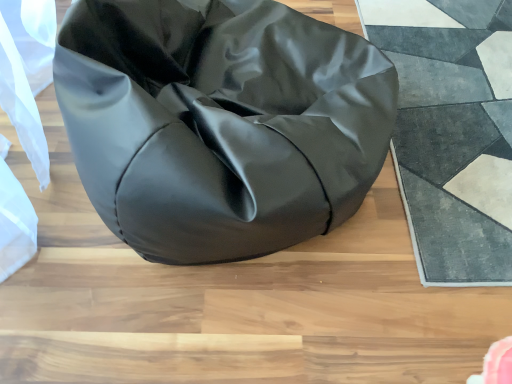
This screenshot has width=512, height=384. What do you see at coordinates (220, 123) in the screenshot? I see `matte black bean bag at center` at bounding box center [220, 123].

Locate an element on the screen. This screenshot has width=512, height=384. matte black bean bag at center is located at coordinates tap(220, 123).

Describe the element at coordinates (452, 132) in the screenshot. I see `textured gray rug at right` at that location.

Identify the location of textured gray rug at right. The height and width of the screenshot is (384, 512). (452, 132).

Where is `matte black bean bag at center`? matte black bean bag at center is located at coordinates (220, 123).

Is matte black bean bag at center to the right of textured gray rug at right from the viewer's perspective?

No.

Is matte black bean bag at center behind textured gray rug at right?

No, matte black bean bag at center is closer to the camera.

Is point (78, 35) farther from camera compared to point (499, 186)?

No, it is in front of (499, 186).

From the image's perspective, which is above, matte black bean bag at center or textured gray rug at right?

matte black bean bag at center appears higher in the image.

From a real-world perspective, is matte black bean bag at center under textured gray rug at right?

No, from a real-world perspective, matte black bean bag at center is not below textured gray rug at right.

Considering the sizes of objects matte black bean bag at center and textured gray rug at right in the image provided, who is wider, matte black bean bag at center or textured gray rug at right?

matte black bean bag at center.

Between matte black bean bag at center and textured gray rug at right, which one has more height?

With more height is matte black bean bag at center.

Can you confirm if matte black bean bag at center is bigger than textured gray rug at right?

Yes, matte black bean bag at center is bigger than textured gray rug at right.

Do you think matte black bean bag at center is within textured gray rug at right, or outside of it?

matte black bean bag at center is not enclosed by textured gray rug at right.

Is matte black bean bag at center touching textured gray rug at right?

No, matte black bean bag at center is not making contact with textured gray rug at right.

Could you tell me if matte black bean bag at center is turned towards textured gray rug at right?

No.

Where is `furniture above the textured gray rug at right (from a real-world perspective)`? furniture above the textured gray rug at right (from a real-world perspective) is located at coordinates (220, 123).

Can you confirm if textured gray rug at right is positioned to the left of matte black bean bag at center?

No, textured gray rug at right is not to the left of matte black bean bag at center.

From the picture: Is textured gray rug at right further to camera compared to matte black bean bag at center?

That is True.

Considering the points (489, 68) and (293, 97), which point is in front, point (489, 68) or point (293, 97)?

The point (293, 97) is closer to the camera.

In the scene shown: From the image's perspective, does textured gray rug at right appear higher than matte black bean bag at center?

No, from the image's perspective, textured gray rug at right is not on top of matte black bean bag at center.

From a real-world perspective, is textured gray rug at right on top of matte black bean bag at center?

No, from a real-world perspective, textured gray rug at right is not on top of matte black bean bag at center.

Consider the image. Which of these two, textured gray rug at right or matte black bean bag at center, is thinner?

textured gray rug at right is thinner.

Between textured gray rug at right and matte black bean bag at center, which one has less height?

With less height is textured gray rug at right.

Looking at the image, does textured gray rug at right seem bigger or smaller compared to matte black bean bag at center?

Clearly, textured gray rug at right is smaller in size than matte black bean bag at center.

Is textured gray rug at right situated inside matte black bean bag at center or outside?

textured gray rug at right cannot be found inside matte black bean bag at center.

Is textured gray rug at right next to matte black bean bag at center and touching it?

textured gray rug at right and matte black bean bag at center are clearly separated.

Is textured gray rug at right oriented away from matte black bean bag at center?

No, textured gray rug at right is not facing away from matte black bean bag at center.

How many degrees apart are the facing directions of textured gray rug at right and matte black bean bag at center?

The angular difference between textured gray rug at right and matte black bean bag at center is 90 degrees.

Locate an element on the screen. This screenshot has width=512, height=384. mat directly beneath the matte black bean bag at center (from a real-world perspective) is located at coordinates (452, 132).

Find the location of a particular element. mat located behind the matte black bean bag at center is located at coordinates (452, 132).

Image resolution: width=512 pixels, height=384 pixels. Identify the location of mat that is below the matte black bean bag at center (from the image's perspective). (452, 132).